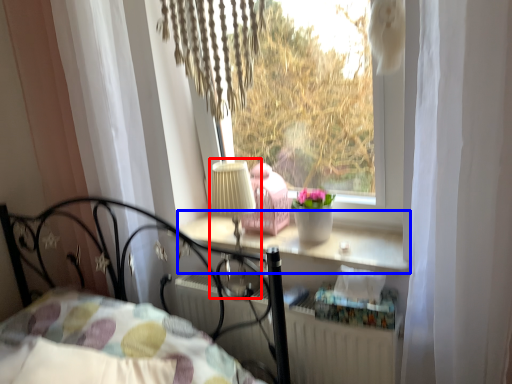
Question: Which object appears closest to the camera in this image, table lamp (highlighted by a red box) or window sill (highlighted by a blue box)?

Choices:
 (A) table lamp
 (B) window sill

Answer: (B)